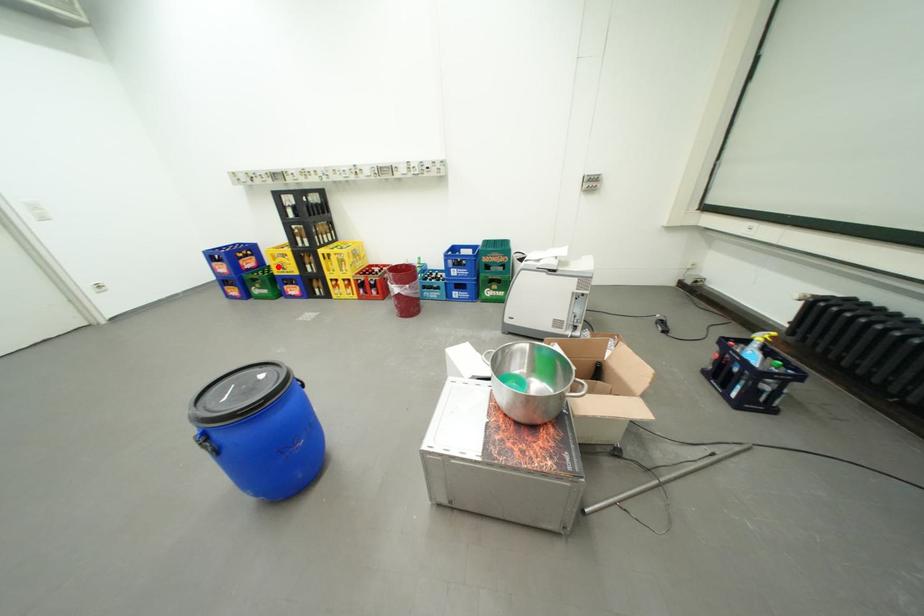
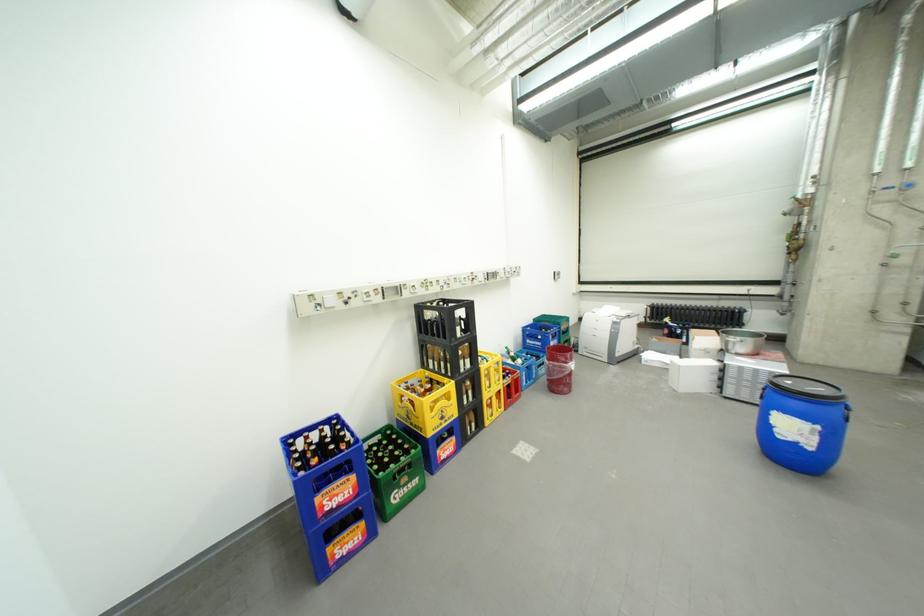
Question: I am providing you with two images of the same scene from different viewpoints. A red point is marked on the first image. Can you still see the location of the red point in image 2?

Choices:
 (A) Yes
 (B) No

Answer: (A)